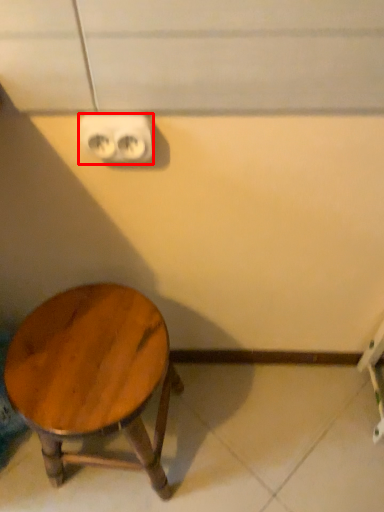
Question: From the image's perspective, what is the correct spatial positioning of electric outlet (annotated by the red box) in reference to stool?

Choices:
 (A) below
 (B) above

Answer: (B)